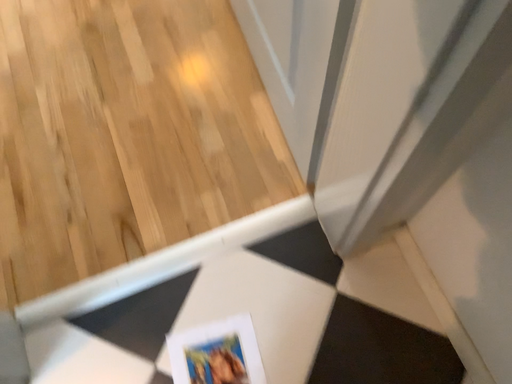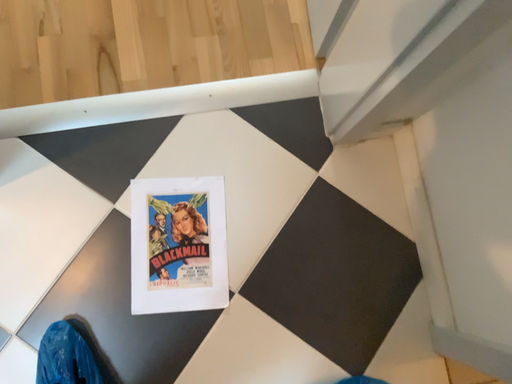
Question: How did the camera likely rotate when shooting the video?

Choices:
 (A) rotated downward
 (B) rotated upward

Answer: (A)